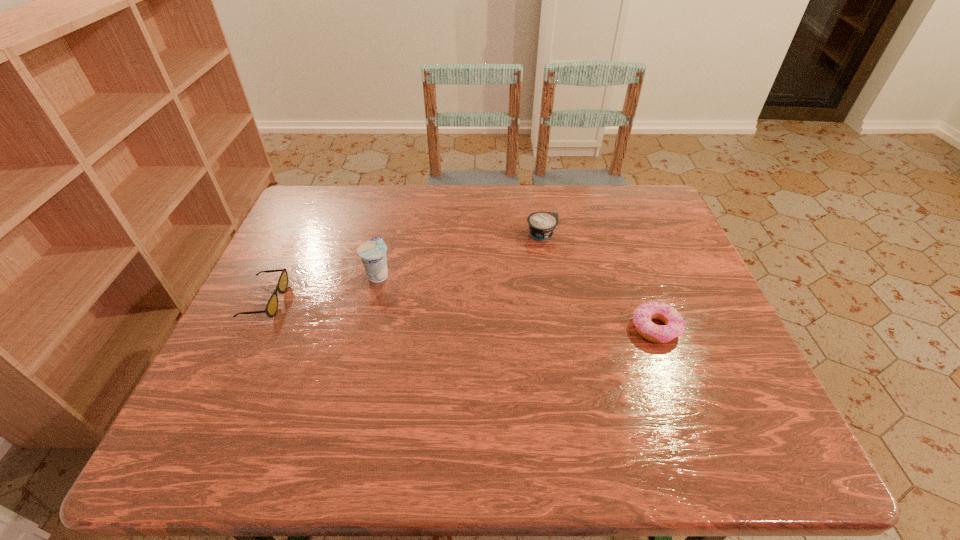
Find the location of a particular element. The image size is (960, 540). vacant region located 0.110m on the right of the rightmost object is located at coordinates (728, 328).

Where is `object that is positioned at the far edge`? object that is positioned at the far edge is located at coordinates (542, 224).

Where is `object that is at the left edge`? object that is at the left edge is located at coordinates (271, 308).

I want to click on object present at the right edge, so (x=674, y=326).

What are the coordinates of `vacant space at the far edge of the desktop` in the screenshot? It's located at (390, 226).

In the image, there is a desktop. At what (x,y) coordinates should I click in order to perform the action: click on vacant space at the near edge. Please return your answer as a coordinate pair (x, y). The height and width of the screenshot is (540, 960). Looking at the image, I should click on click(432, 426).

Image resolution: width=960 pixels, height=540 pixels. In the image, there is a desktop. What are the coordinates of `vacant space at the left edge` in the screenshot? It's located at (211, 369).

Locate an element on the screen. The image size is (960, 540). vacant space at the right edge of the desktop is located at coordinates (649, 291).

Image resolution: width=960 pixels, height=540 pixels. What are the coordinates of `blank space at the far left corner` in the screenshot? It's located at (294, 227).

Identify the location of vacant space at the far right corner of the desktop. This screenshot has width=960, height=540. (636, 194).